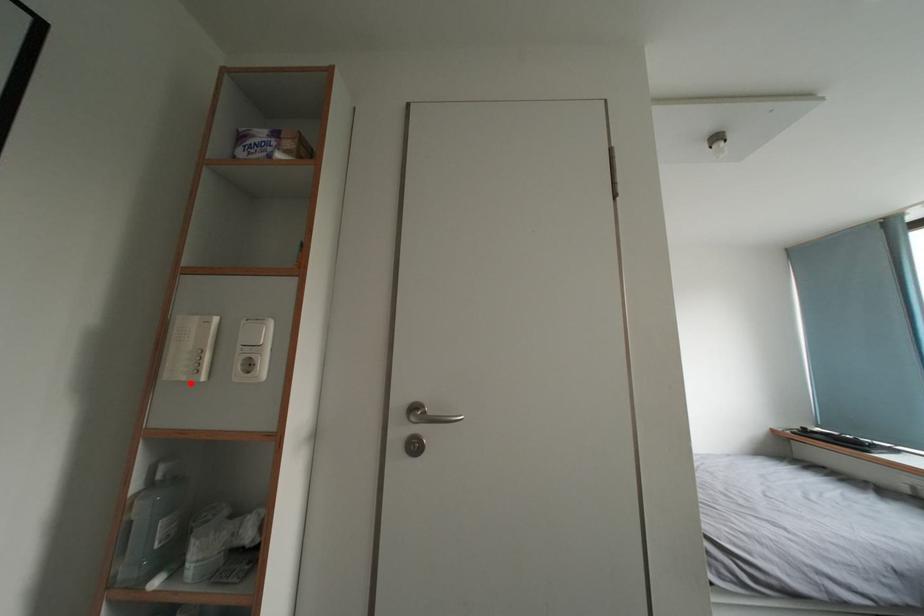
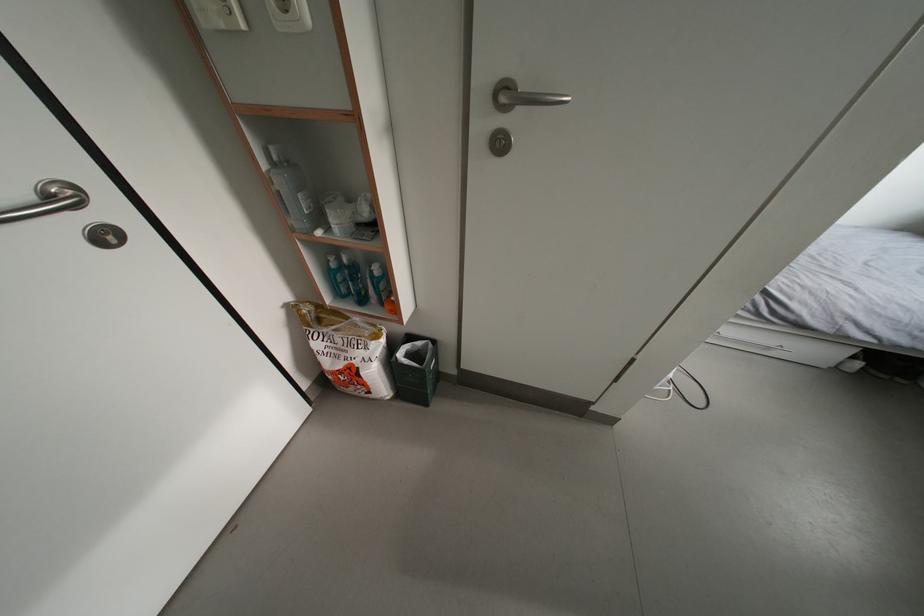
Question: I am providing you with two images of the same scene from different viewpoints. A red point is marked on the first image. At the location where the point appears in image 1, is it still visible in image 2?

Choices:
 (A) Yes
 (B) No

Answer: (A)